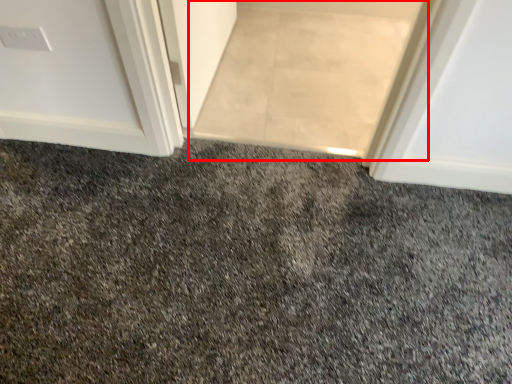
Question: In this image, where is doormat (annotated by the red box) located relative to granite?

Choices:
 (A) right
 (B) left

Answer: (A)